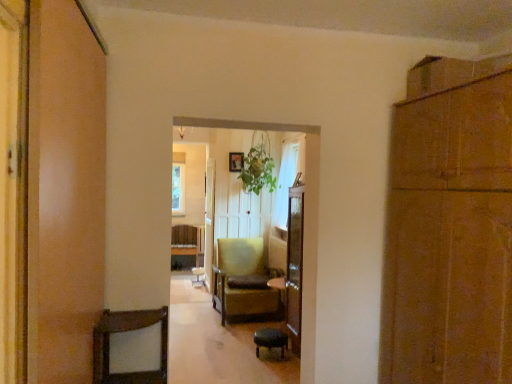
Question: From the image's perspective, is green leafy plant at center above or below brown cardboard cabinet at right?

Choices:
 (A) above
 (B) below

Answer: (A)

Question: From a real-world perspective, is green leafy plant at center physically located above or below brown cardboard cabinet at right?

Choices:
 (A) below
 (B) above

Answer: (B)

Question: Which of these objects is positioned closest to the green leafy plant at center?

Choices:
 (A) brown cardboard cabinet at right
 (B) brown leather bar stool at lower center
 (C) yellow fabric chair at center

Answer: (C)

Question: Based on their relative distances, which object is nearer to the brown leather bar stool at lower center?

Choices:
 (A) brown cardboard cabinet at right
 (B) green leafy plant at center
 (C) yellow fabric chair at center

Answer: (C)